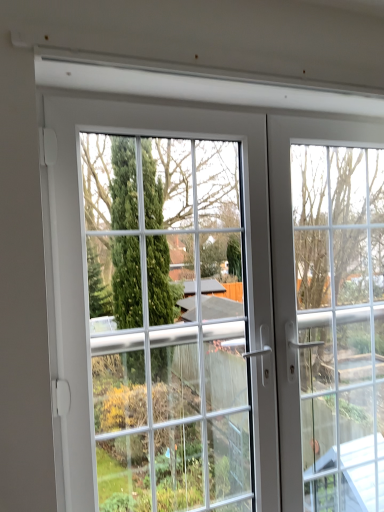
The width and height of the screenshot is (384, 512). Find the location of `white plastic window frame at right`. white plastic window frame at right is located at coordinates (340, 323).

This screenshot has height=512, width=384. Describe the element at coordinates (340, 323) in the screenshot. I see `white plastic window frame at right` at that location.

This screenshot has width=384, height=512. I want to click on white glass door at center, so click(x=252, y=259).

The image size is (384, 512). What do you see at coordinates (252, 259) in the screenshot?
I see `white glass door at center` at bounding box center [252, 259].

Locate an element on the screen. Image resolution: width=384 pixels, height=512 pixels. white plastic window frame at right is located at coordinates (340, 323).

Considering the positions of objects white plastic window frame at right and white glass door at center in the image provided, who is more to the right, white plastic window frame at right or white glass door at center?

From the viewer's perspective, white plastic window frame at right appears more on the right side.

In the image, is white plastic window frame at right positioned in front of or behind white glass door at center?

white plastic window frame at right is behind white glass door at center.

Does point (368, 342) appear closer or farther from the camera than point (353, 122)?

Point (368, 342).

Consider the image. From the image's perspective, which is above, white plastic window frame at right or white glass door at center?

From the image's view, white glass door at center is above.

Consider the image. From a real-world perspective, is white plastic window frame at right positioned above or below white glass door at center?

white plastic window frame at right is situated lower than white glass door at center in the real world.

Based on the photo, which object is wider, white plastic window frame at right or white glass door at center?

white glass door at center is wider.

Between white plastic window frame at right and white glass door at center, which one has less height?

white plastic window frame at right.

Considering the sizes of objects white plastic window frame at right and white glass door at center in the image provided, who is bigger, white plastic window frame at right or white glass door at center?

white glass door at center.

Is white glass door at center a part of white plastic window frame at right?

No, white glass door at center is located outside of white plastic window frame at right.

From the picture: Are white plastic window frame at right and white glass door at center beside each other?

white plastic window frame at right and white glass door at center are clearly separated.

Is white plastic window frame at right turned away from white glass door at center?

Yes.

Locate an element on the screen. This screenshot has width=384, height=512. window frame lying on the right of white glass door at center is located at coordinates (340, 323).

Between white glass door at center and white plastic window frame at right, which one appears on the left side from the viewer's perspective?

Positioned to the left is white glass door at center.

Is white glass door at center closer to camera compared to white plastic window frame at right?

Yes, white glass door at center is closer to the viewer.

Is point (282, 179) farther from viewer compared to point (358, 319)?

No, it is not.

From the image's perspective, which one is positioned lower, white glass door at center or white plastic window frame at right?

white plastic window frame at right, from the image's perspective.

From a real-world perspective, is white glass door at center physically located above or below white plastic window frame at right?

white glass door at center is above white plastic window frame at right.

Considering the relative sizes of white glass door at center and white plastic window frame at right in the image provided, is white glass door at center wider than white plastic window frame at right?

Indeed, white glass door at center has a greater width compared to white plastic window frame at right.

Is white glass door at center taller or shorter than white plastic window frame at right?

Considering their sizes, white glass door at center has more height than white plastic window frame at right.

Can you confirm if white glass door at center is bigger than white plastic window frame at right?

Correct, white glass door at center is larger in size than white plastic window frame at right.

Is white glass door at center positioned beyond the bounds of white plastic window frame at right?

Yes.

Can you see white glass door at center touching white plastic window frame at right?

No, white glass door at center is not beside white plastic window frame at right.

Is white glass door at center oriented away from white plastic window frame at right?

Yes, white plastic window frame at right is at the back of white glass door at center.

How many degrees apart are the facing directions of white glass door at center and white plastic window frame at right?

white glass door at center and white plastic window frame at right are facing 0.513 degrees away from each other.

How much distance is there between white glass door at center and white plastic window frame at right?

They are 14.96 inches apart.

Locate an element on the screen. Image resolution: width=384 pixels, height=512 pixels. window frame lying on the right of white glass door at center is located at coordinates (340, 323).

The image size is (384, 512). I want to click on window frame that appears behind the white glass door at center, so click(x=340, y=323).

The height and width of the screenshot is (512, 384). I want to click on door in front of the white plastic window frame at right, so click(x=252, y=259).